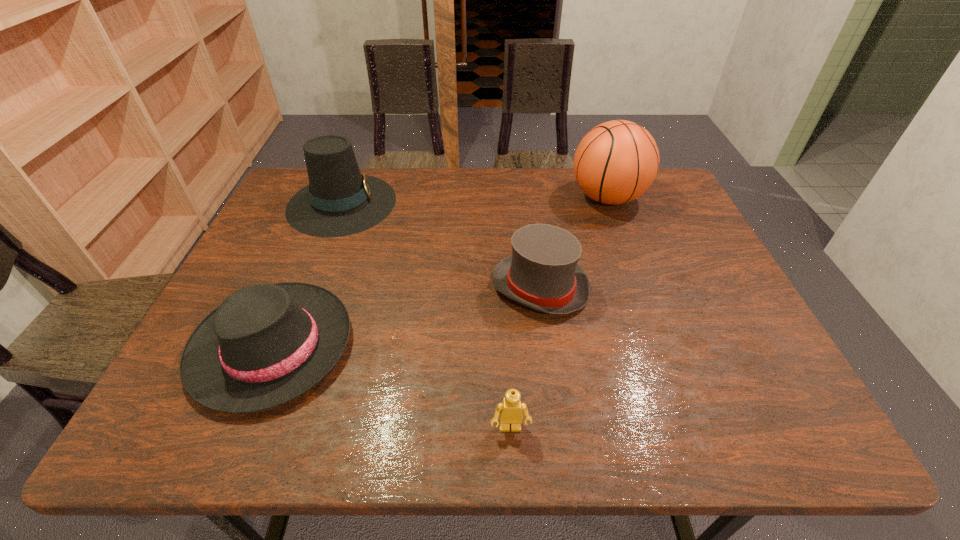
The width and height of the screenshot is (960, 540). Find the location of `basketball`. basketball is located at coordinates (616, 162).

I want to click on the rightmost object, so click(x=616, y=162).

The width and height of the screenshot is (960, 540). I want to click on the tallest dress hat, so click(x=339, y=201).

You are a GUI agent. You are given a task and a screenshot of the screen. Output one action in this format:
    pyautogui.click(x=<x>, y=<y>)
    Task: Click on the farthest dress hat
    
    Given the screenshot: What is the action you would take?
    pyautogui.click(x=339, y=201)

Identify the location of the rightmost dress hat. (542, 273).

You are a GUI agent. You are given a task and a screenshot of the screen. Output one action in this format:
    pyautogui.click(x=<x>, y=<y>)
    Task: Click on the Lego
    
    Given the screenshot: What is the action you would take?
    pyautogui.click(x=511, y=410)

At what (x,y) coordinates should I click in order to perform the action: click on free space located 0.270m on the front of the rightmost object. Please return your answer as a coordinate pair (x, y). Image resolution: width=960 pixels, height=540 pixels. Looking at the image, I should click on (x=640, y=288).

Identify the location of free point located 0.070m on the front-facing side of the farthest dress hat. (419, 203).

Find the location of a particular element. Image resolution: width=960 pixels, height=540 pixels. free space located 0.110m on the right of the rightmost dress hat is located at coordinates (633, 287).

At what (x,y) coordinates should I click in order to perform the action: click on basketball that is positioned at the far edge. Please return your answer as a coordinate pair (x, y). This screenshot has height=540, width=960. Looking at the image, I should click on (616, 162).